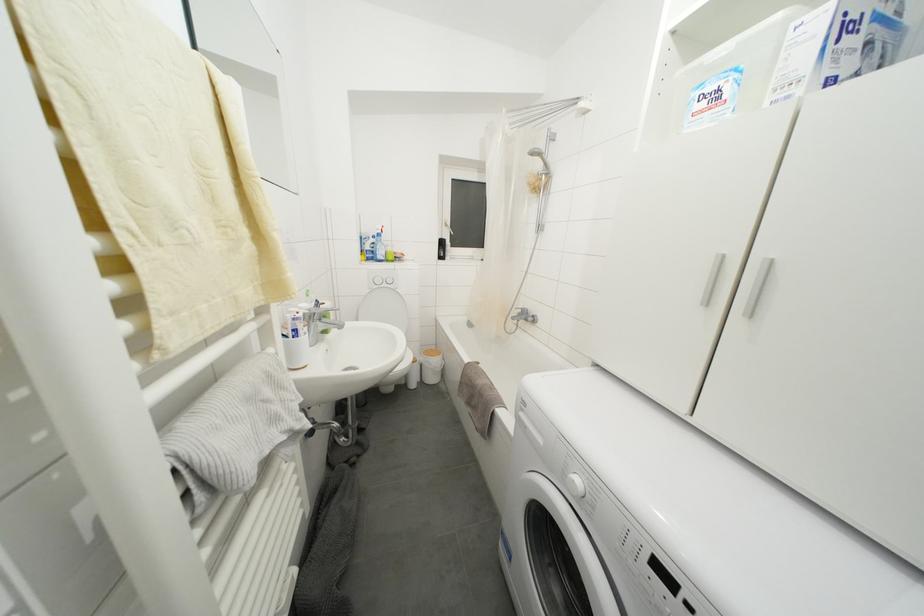
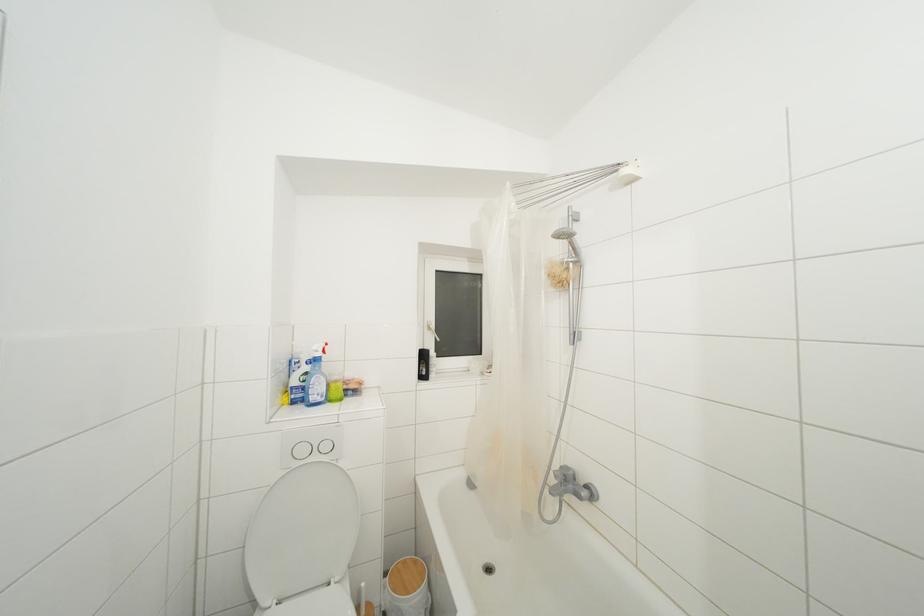
Locate, in the second image, the point that corresponds to (550,168) in the first image.

(578, 254)